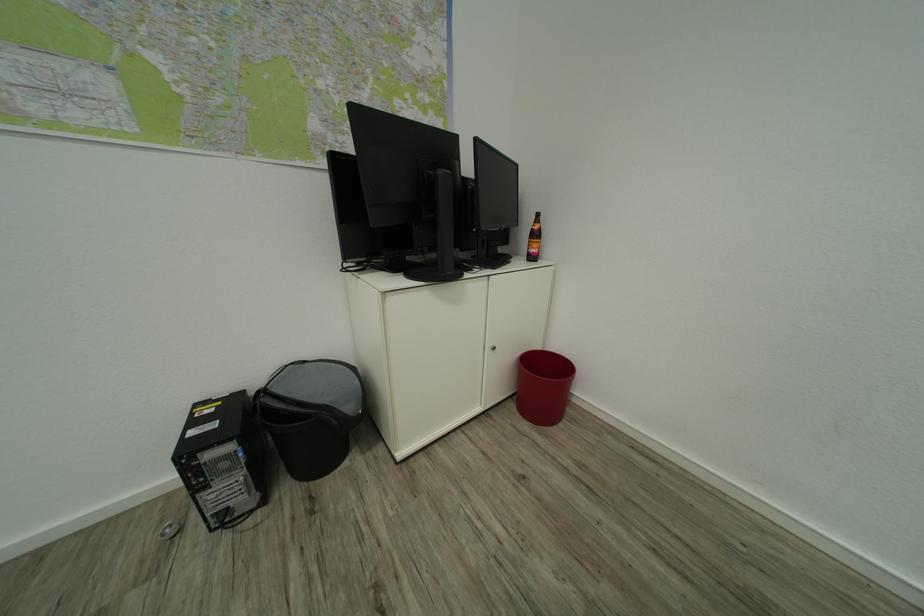
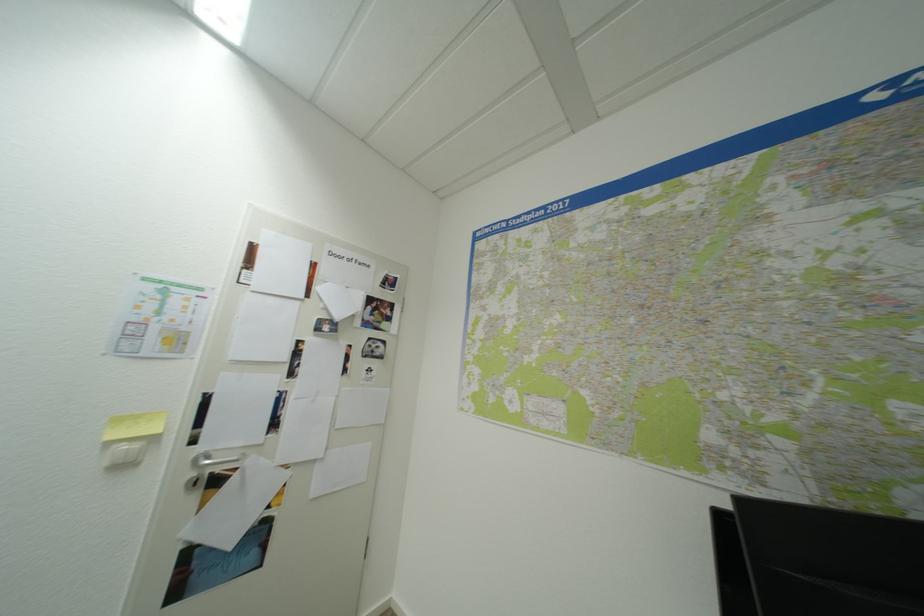
How did the camera likely rotate?

The camera's rotation is toward left-up.